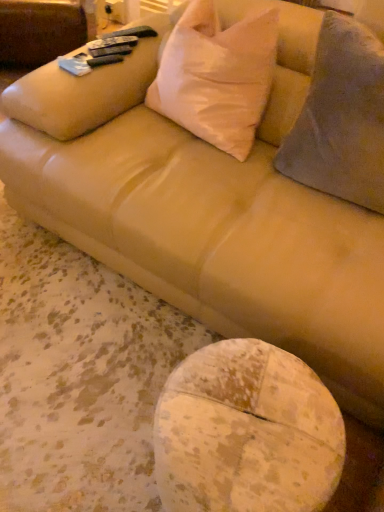
The image size is (384, 512). Find the location of `empty space that is ontop of speckled wood table at lower center (from a real-world perspective)`. empty space that is ontop of speckled wood table at lower center (from a real-world perspective) is located at coordinates (249, 419).